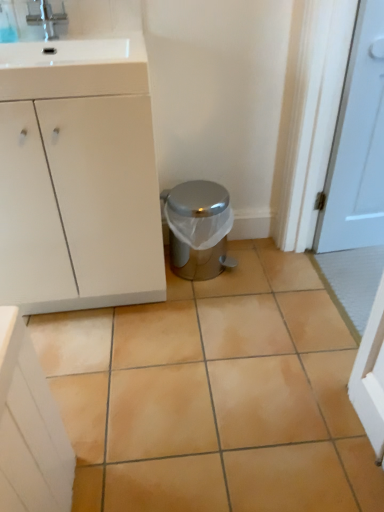
Find the location of a particular element. This screenshot has height=512, width=384. empty space that is ontop of beige ceramic tile at center is located at coordinates (194, 350).